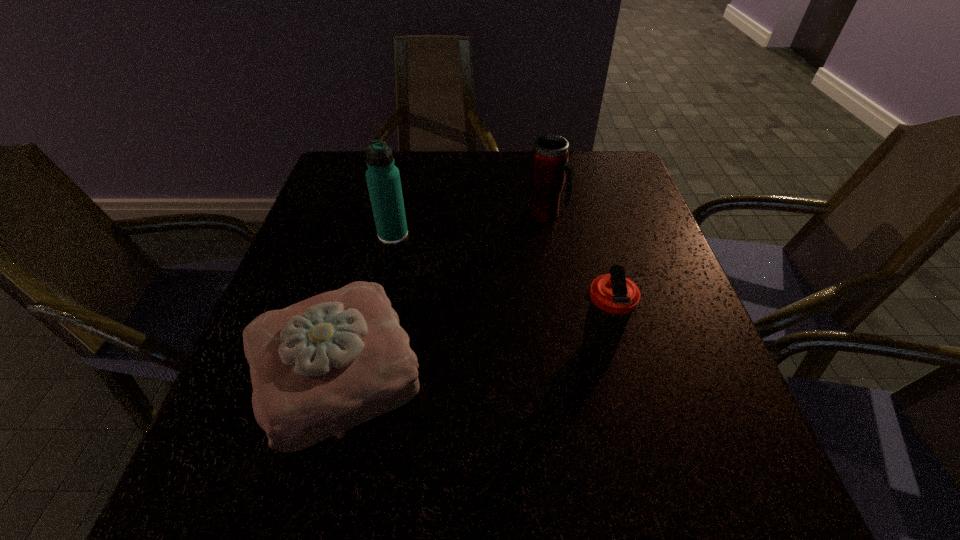
Identify which thermos bottle is located as the second nearest to the nearest thermos bottle. Please provide its 2D coordinates. Your answer should be formatted as a tuple, i.e. [(x, y)], where the tuple contains the x and y coordinates of a point satisfying the conditions above.

[(383, 179)]

Choose which thermos bottle is the second nearest neighbor to the tallest thermos bottle. Please provide its 2D coordinates. Your answer should be formatted as a tuple, i.e. [(x, y)], where the tuple contains the x and y coordinates of a point satisfying the conditions above.

[(612, 297)]

I want to click on vacant space that satisfies the following two spatial constraints: 1. on the back side of the nearest thermos bottle; 2. on the left side of the cake, so click(x=342, y=352).

In order to click on free space in the image that satisfies the following two spatial constraints: 1. on the front side of the leftmost thermos bottle; 2. on the left side of the nearest thermos bottle in this screenshot , I will do `click(368, 352)`.